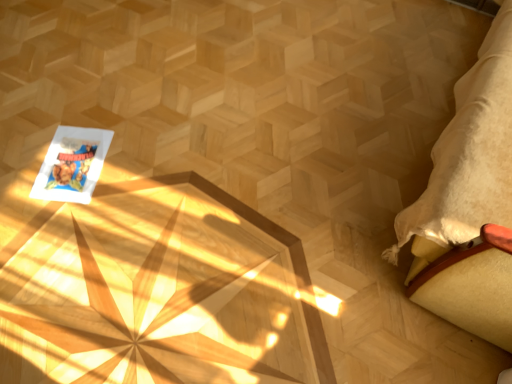
At what (x,y) coordinates should I click in order to perform the action: click on free space to the back side of beige fabric cushion at right. Please return your answer as a coordinate pair (x, y). Looking at the image, I should click on (395, 42).